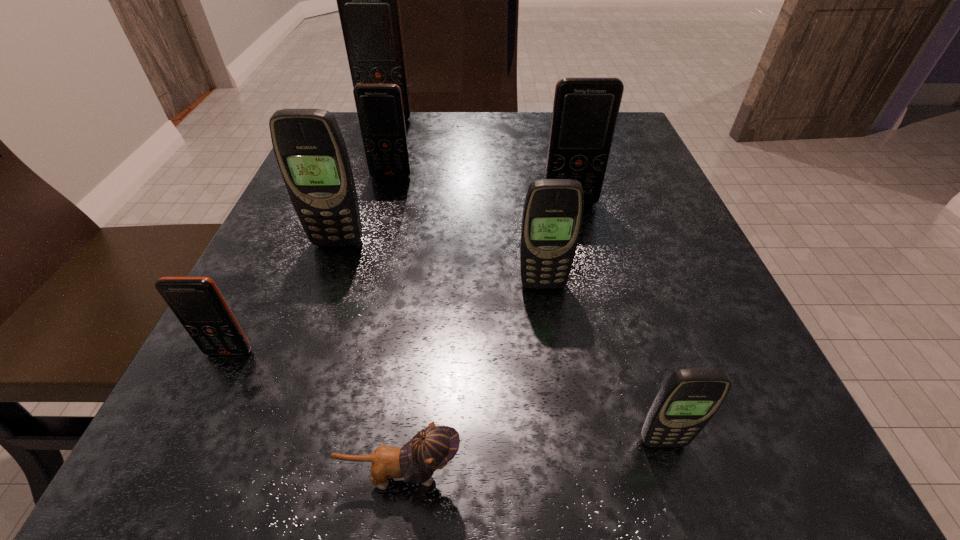
Find the location of a particular element. The height and width of the screenshot is (540, 960). vacant area that lies between the smallest gray cellular telephone and the second nearest cellular telephone is located at coordinates (446, 397).

What are the coordinates of `vacant area that lies between the farthest gray cellular telephone and the leftmost orange cellular telephone` in the screenshot? It's located at (283, 298).

Locate which object is the closest to the second smallest gray cellular telephone. Please provide its 2D coordinates. Your answer should be formatted as a tuple, i.e. [(x, y)], where the tuple contains the x and y coordinates of a point satisfying the conditions above.

[(585, 110)]

Identify which object is located as the fifth nearest to the fourth farthest object. Please provide its 2D coordinates. Your answer should be formatted as a tuple, i.e. [(x, y)], where the tuple contains the x and y coordinates of a point satisfying the conditions above.

[(433, 447)]

Point out which cellular telephone is positioned as the second nearest to the third farthest cellular telephone. Please provide its 2D coordinates. Your answer should be formatted as a tuple, i.e. [(x, y)], where the tuple contains the x and y coordinates of a point satisfying the conditions above.

[(379, 107)]

The image size is (960, 540). I want to click on cellular telephone that is the fourth nearest to the leftmost orange cellular telephone, so click(689, 398).

Where is `the closest orange cellular telephone to the farthest gray cellular telephone`? the closest orange cellular telephone to the farthest gray cellular telephone is located at coordinates (379, 107).

Identify which orange cellular telephone is the closest to the third farthest object. Please provide its 2D coordinates. Your answer should be formatted as a tuple, i.e. [(x, y)], where the tuple contains the x and y coordinates of a point satisfying the conditions above.

[(379, 107)]

Find the location of a particular element. This screenshot has height=540, width=960. gray cellular telephone object that ranks as the second closest to the fifth nearest cellular telephone is located at coordinates (311, 153).

Choose which gray cellular telephone is the third nearest neighbor to the kitten. Please provide its 2D coordinates. Your answer should be formatted as a tuple, i.e. [(x, y)], where the tuple contains the x and y coordinates of a point satisfying the conditions above.

[(311, 153)]